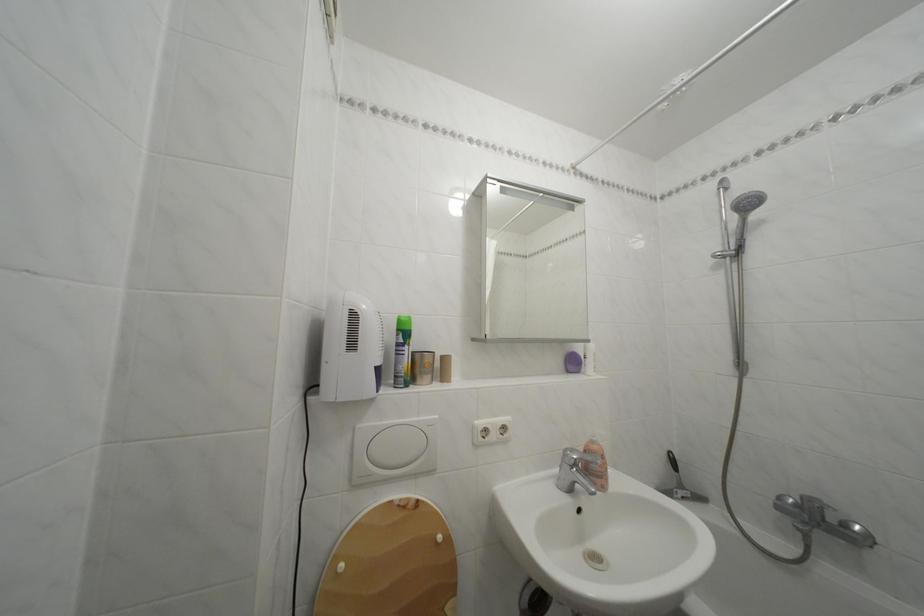
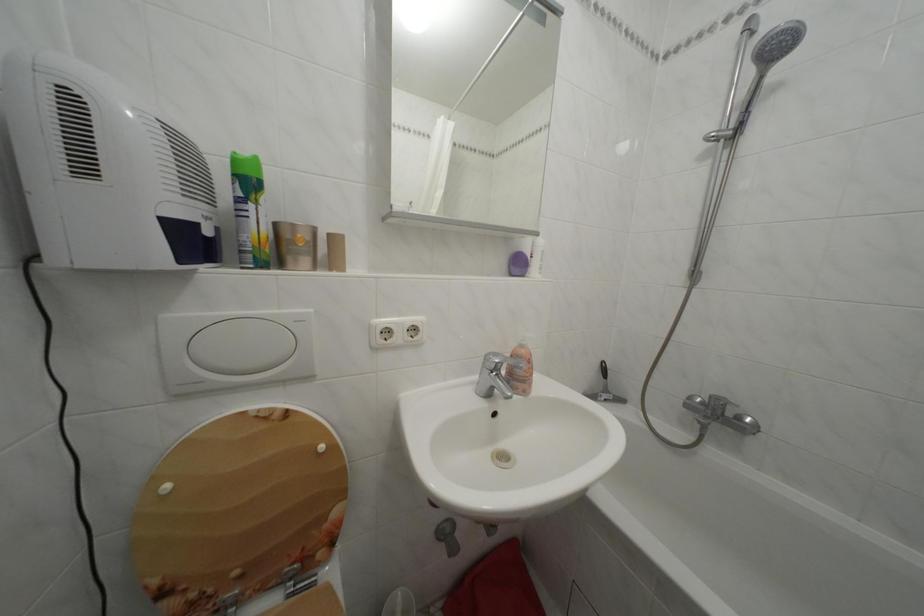
The point at (x=689, y=492) is marked in the first image. Where is the corresponding point in the second image?

(614, 397)